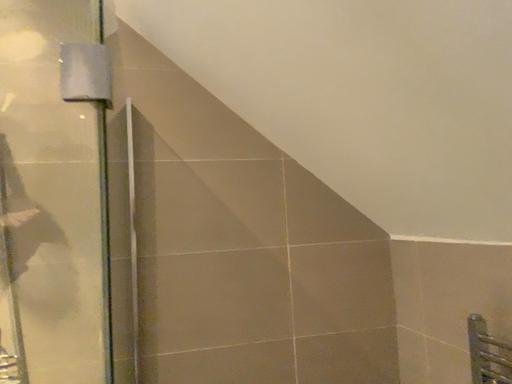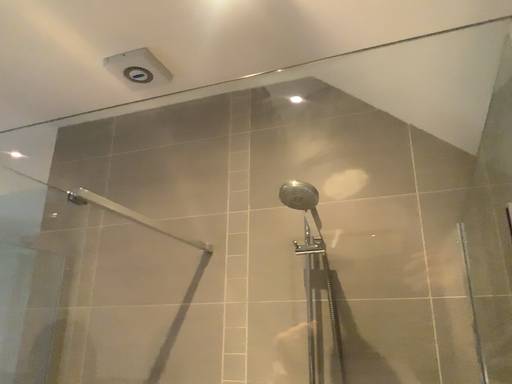
Question: How did the camera likely rotate when shooting the video?

Choices:
 (A) rotated left
 (B) rotated right

Answer: (A)